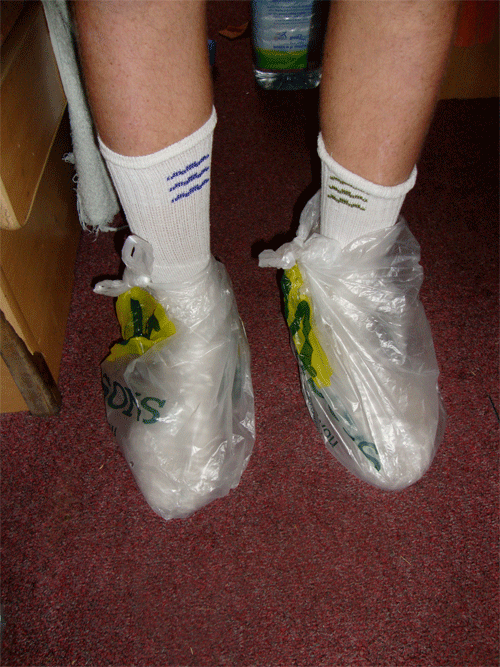
This screenshot has width=500, height=667. Identify the location of plastic water jug. (289, 27), (294, 79), (315, 47).